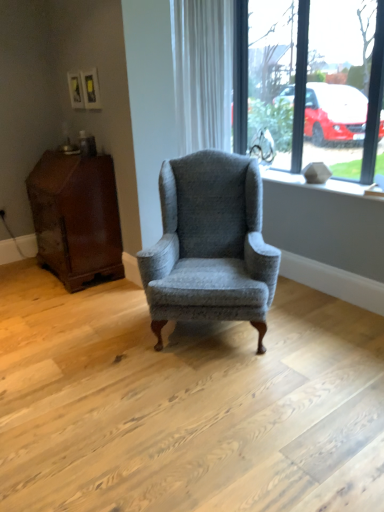
What do you see at coordinates (210, 244) in the screenshot? The image size is (384, 512). I see `textured gray wingback chair at center` at bounding box center [210, 244].

What do you see at coordinates (76, 217) in the screenshot?
I see `mahogany wood side table at left` at bounding box center [76, 217].

What do you see at coordinates (313, 184) in the screenshot?
I see `white textured stone at upper right` at bounding box center [313, 184].

Describe the element at coordinates (202, 72) in the screenshot. I see `white textured curtain at upper center` at that location.

Locate an element on the screen. The width and height of the screenshot is (384, 512). textured gray wingback chair at center is located at coordinates (210, 244).

From a real-world perspective, is white textured curtain at upper center physically below white textured stone at upper right?

No, from a real-world perspective, white textured curtain at upper center is not beneath white textured stone at upper right.

Which object is further away from the camera, white textured curtain at upper center or white textured stone at upper right?

white textured curtain at upper center is further from the camera.

Is point (220, 91) more distant than point (294, 182)?

Yes, point (220, 91) is farther from viewer.

Is clear glass window at upper right located within white textured stone at upper right?

That's incorrect, clear glass window at upper right is not inside white textured stone at upper right.

Find the location of a particular element. window sill that appears on the right of clear glass window at upper right is located at coordinates (313, 184).

Looking at their sizes, would you say white textured stone at upper right is wider or thinner than clear glass window at upper right?

In the image, white textured stone at upper right appears to be wider than clear glass window at upper right.

Consider the image. How different are the orientations of white textured stone at upper right and clear glass window at upper right in degrees?

0.197 degrees separate the facing orientations of white textured stone at upper right and clear glass window at upper right.

Considering the sizes of objects white textured curtain at upper center and mahogany wood side table at left in the image provided, who is taller, white textured curtain at upper center or mahogany wood side table at left?

With more height is white textured curtain at upper center.

Considering the relative sizes of white textured curtain at upper center and mahogany wood side table at left in the image provided, is white textured curtain at upper center thinner than mahogany wood side table at left?

Yes, white textured curtain at upper center is thinner than mahogany wood side table at left.

Can you confirm if white textured curtain at upper center is smaller than mahogany wood side table at left?

Indeed, white textured curtain at upper center has a smaller size compared to mahogany wood side table at left.

Between white textured curtain at upper center and mahogany wood side table at left, which one is positioned behind?

Positioned behind is mahogany wood side table at left.

Is mahogany wood side table at left in front of or behind textured gray wingback chair at center in the image?

In the image, mahogany wood side table at left appears behind textured gray wingback chair at center.

Image resolution: width=384 pixels, height=512 pixels. Identify the location of chair on the right of mahogany wood side table at left. (210, 244).

Considering the positions of objects mahogany wood side table at left and textured gray wingback chair at center in the image provided, who is more to the right, mahogany wood side table at left or textured gray wingback chair at center?

textured gray wingback chair at center is more to the right.

Between point (53, 271) and point (214, 288), which one is positioned behind?

The point (53, 271) is more distant.

From the image's perspective, which is above, textured gray wingback chair at center or clear glass window at upper right?

clear glass window at upper right is shown above in the image.

Considering the relative sizes of textured gray wingback chair at center and clear glass window at upper right in the image provided, is textured gray wingback chair at center wider than clear glass window at upper right?

Yes.

Which of these two, textured gray wingback chair at center or clear glass window at upper right, stands shorter?

textured gray wingback chair at center.

Is textured gray wingback chair at center to the left of clear glass window at upper right from the viewer's perspective?

Yes.

Does point (275, 268) lie behind point (379, 191)?

No, (275, 268) is in front of (379, 191).

Can you confirm if textured gray wingback chair at center is positioned to the right of white textured stone at upper right?

In fact, textured gray wingback chair at center is to the left of white textured stone at upper right.

Locate an element on the screen. The width and height of the screenshot is (384, 512). chair on the left side of white textured stone at upper right is located at coordinates (210, 244).

From the image's perspective, which one is positioned higher, textured gray wingback chair at center or white textured stone at upper right?

white textured stone at upper right.

Which point is more distant from viewer, (98, 200) or (275, 179)?

Positioned behind is point (275, 179).

From a real-world perspective, is mahogany wood side table at left positioned over white textured stone at upper right based on gravity?

No, from a real-world perspective, mahogany wood side table at left is not over white textured stone at upper right

Is mahogany wood side table at left to the left of white textured stone at upper right from the viewer's perspective?

Yes, mahogany wood side table at left is to the left of white textured stone at upper right.

Could white textured stone at upper right be considered to be inside mahogany wood side table at left?

Actually, white textured stone at upper right is outside mahogany wood side table at left.

Locate an element on the screen. window sill on the right of the white textured curtain at upper center is located at coordinates (313, 184).

This screenshot has height=512, width=384. I want to click on window sill below the clear glass window at upper right (from the image's perspective), so click(313, 184).

Estimate the real-world distances between objects in this image. Which object is closer to white textured stone at upper right, clear glass window at upper right or textured gray wingback chair at center?

clear glass window at upper right is positioned closer to the anchor white textured stone at upper right.

When comparing their distances from clear glass window at upper right, does white textured curtain at upper center or textured gray wingback chair at center seem closer?

Based on the image, white textured curtain at upper center appears to be nearer to clear glass window at upper right.

From the image, which object appears to be nearer to white textured curtain at upper center, textured gray wingback chair at center or white textured stone at upper right?

white textured stone at upper right is positioned closer to the anchor white textured curtain at upper center.

From the image, which object appears to be farther from mahogany wood side table at left, clear glass window at upper right or textured gray wingback chair at center?

clear glass window at upper right is further to mahogany wood side table at left.

Considering their positions, is textured gray wingback chair at center positioned further to clear glass window at upper right than mahogany wood side table at left?

mahogany wood side table at left is positioned further to the anchor clear glass window at upper right.

Consider the image. Considering their positions, is white textured stone at upper right positioned further to clear glass window at upper right than textured gray wingback chair at center?

The object further to clear glass window at upper right is textured gray wingback chair at center.

Based on their spatial positions, is mahogany wood side table at left or textured gray wingback chair at center further from white textured curtain at upper center?

Based on the image, mahogany wood side table at left appears to be further to white textured curtain at upper center.

Estimate the real-world distances between objects in this image. Which object is closer to mahogany wood side table at left, textured gray wingback chair at center or clear glass window at upper right?

textured gray wingback chair at center is positioned closer to the anchor mahogany wood side table at left.

Identify the location of table between white textured curtain at upper center and textured gray wingback chair at center from top to bottom. The height and width of the screenshot is (512, 384). (76, 217).

In order to click on chair located between mahogany wood side table at left and white textured stone at upper right in the left-right direction in this screenshot , I will do `click(210, 244)`.

Locate an element on the screen. window between mahogany wood side table at left and white textured stone at upper right in the horizontal direction is located at coordinates (311, 83).

At what (x,y) coordinates should I click in order to perform the action: click on window sill that lies between clear glass window at upper right and textured gray wingback chair at center from top to bottom. Please return your answer as a coordinate pair (x, y). The height and width of the screenshot is (512, 384). Looking at the image, I should click on (313, 184).